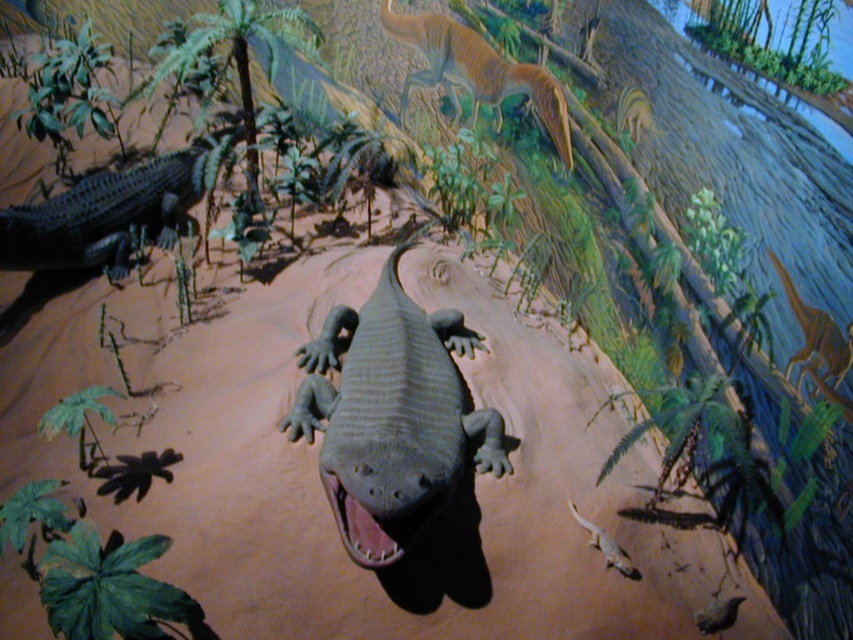
Does smooth brown dinosaur at upper center appear on the right side of smooth brown dinosaur at upper right?

Incorrect, smooth brown dinosaur at upper center is not on the right side of smooth brown dinosaur at upper right.

Which is more to the right, smooth brown dinosaur at upper center or smooth brown dinosaur at upper right?

smooth brown dinosaur at upper right

The width and height of the screenshot is (853, 640). Identify the location of smooth brown dinosaur at upper center. (479, 70).

Who is taller, smooth brown dinosaur at upper right or shiny brown bird at center?

Standing taller between the two is smooth brown dinosaur at upper right.

Which is more to the right, smooth brown dinosaur at upper right or shiny brown bird at center?

Positioned to the right is smooth brown dinosaur at upper right.

Identify the location of smooth brown dinosaur at upper right. The image size is (853, 640). (815, 339).

Find the location of `smooth brown dinosaur at upper right`. smooth brown dinosaur at upper right is located at coordinates (815, 339).

Which is more to the right, smooth brown dinosaur at upper right or smooth beige lizard at lower center?

smooth brown dinosaur at upper right is more to the right.

Which of these two, smooth brown dinosaur at upper right or smooth beige lizard at lower center, stands taller?

With more height is smooth brown dinosaur at upper right.

I want to click on smooth brown dinosaur at upper right, so click(815, 339).